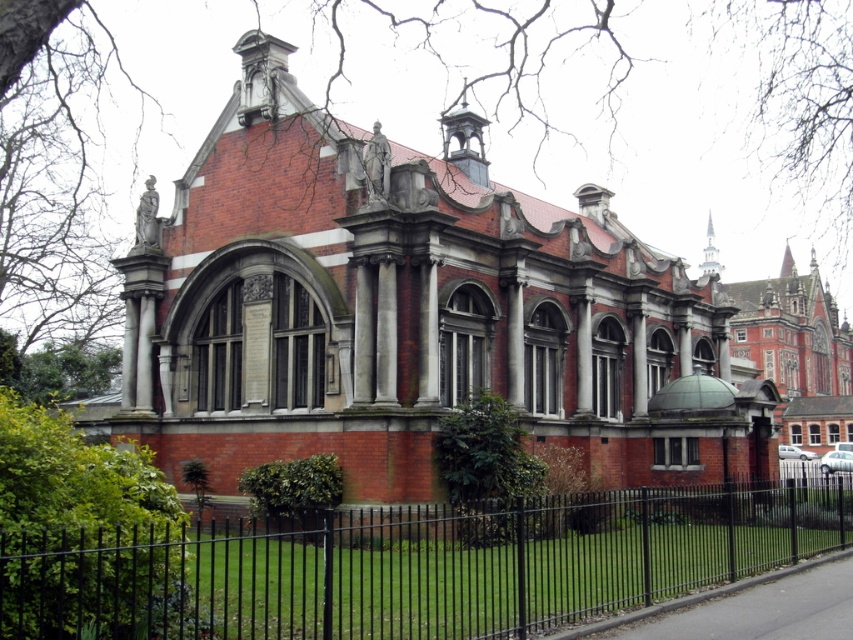
You are standing outside the red brick church at center and want to approach the black metal fence at lower center. In which direction should you move relative to the church?

You should move downward towards the black metal fence at lower center since the red brick church at center is located above it.

You are standing at the entrance of the building and want to take a photo of the red brick church at center. Where should you position yourself to ensure the church is centered in your camera viewfinder?

Since the red brick church at center is located at coordinates approximately 0.487 on the x and 0.481 on the y axis, you should position yourself directly in front of the building, aligning your camera with these coordinates to center the church in your viewfinder.